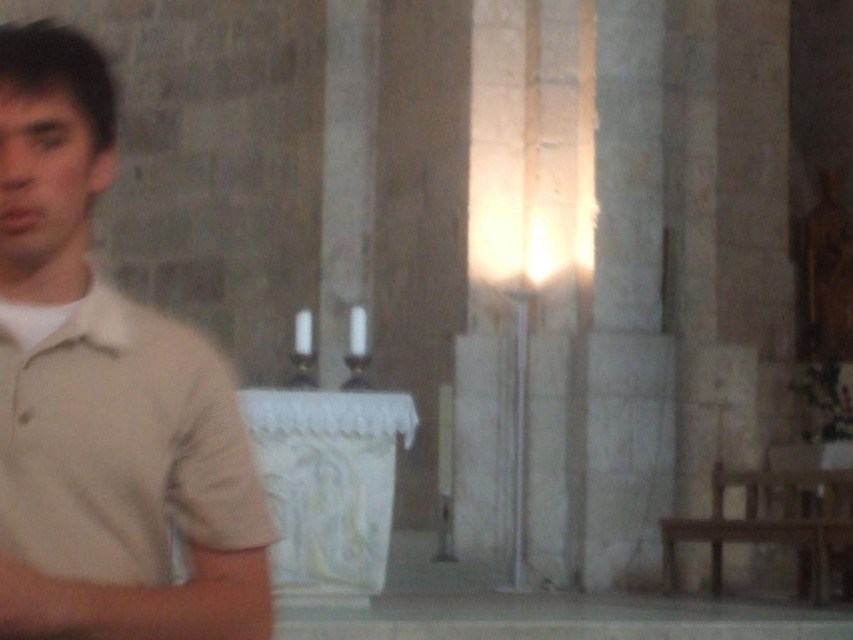
Can you confirm if beige cotton shirt at left is taller than wooden bench at lower right?

Indeed, beige cotton shirt at left has a greater height compared to wooden bench at lower right.

In the scene shown: Does beige cotton shirt at left have a greater width compared to wooden bench at lower right?

Yes, beige cotton shirt at left is wider than wooden bench at lower right.

Is point (221, 420) closer to viewer compared to point (815, 515)?

Yes, it is in front of point (815, 515).

The image size is (853, 640). Find the location of `beige cotton shirt at left`. beige cotton shirt at left is located at coordinates (105, 396).